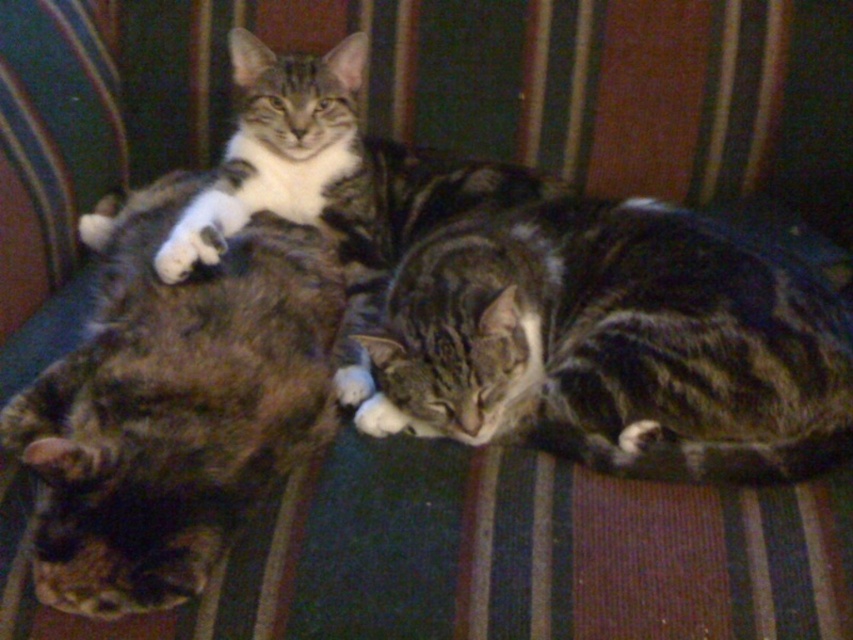
Who is taller, tabby fur cat at center or tabby fur cat at left?

With more height is tabby fur cat at left.

Does tabby fur cat at center appear on the right side of tabby fur cat at left?

Yes, tabby fur cat at center is to the right of tabby fur cat at left.

Describe the element at coordinates (616, 344) in the screenshot. I see `tabby fur cat at center` at that location.

At what (x,y) coordinates should I click in order to perform the action: click on tabby fur cat at center. Please return your answer as a coordinate pair (x, y). This screenshot has width=853, height=640. Looking at the image, I should click on (616, 344).